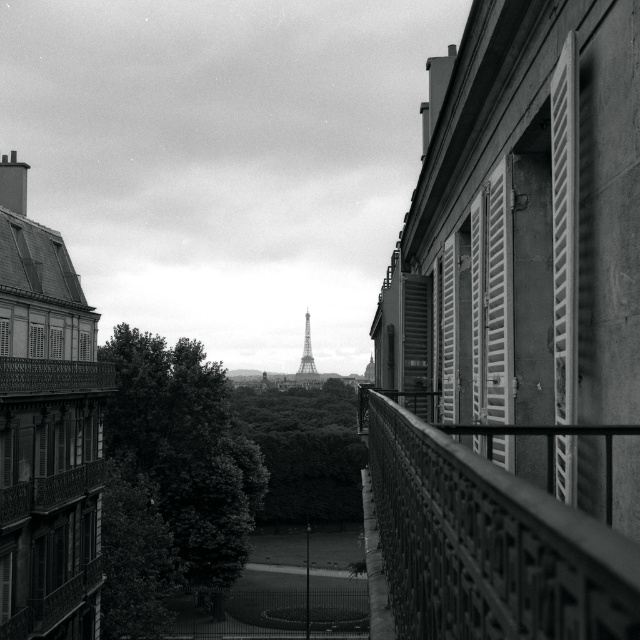
Question: Considering the relative positions of smooth metal railing at center right and white wood shutter at right in the image provided, where is smooth metal railing at center right located with respect to white wood shutter at right?

Choices:
 (A) left
 (B) right

Answer: (A)

Question: Which point is closer to the camera?

Choices:
 (A) (419, 353)
 (B) (304, 349)
 (C) (616, 547)

Answer: (C)

Question: Is dark green leafy tree at center thinner than green leafy tree at center?

Choices:
 (A) yes
 (B) no

Answer: (A)

Question: Can you confirm if dark green leafy tree at center is positioned to the right of white wooden shutter at right?

Choices:
 (A) no
 (B) yes

Answer: (A)

Question: Which of the following is the farthest from the observer?

Choices:
 (A) (60, 330)
 (B) (173, 451)
 (C) (442, 328)
 (D) (605, 625)

Answer: (B)

Question: Estimate the real-world distances between objects in this image. Which object is closer to the metallic silver tower at center?

Choices:
 (A) white wooden shutters at right
 (B) smooth metal railing at center right

Answer: (A)